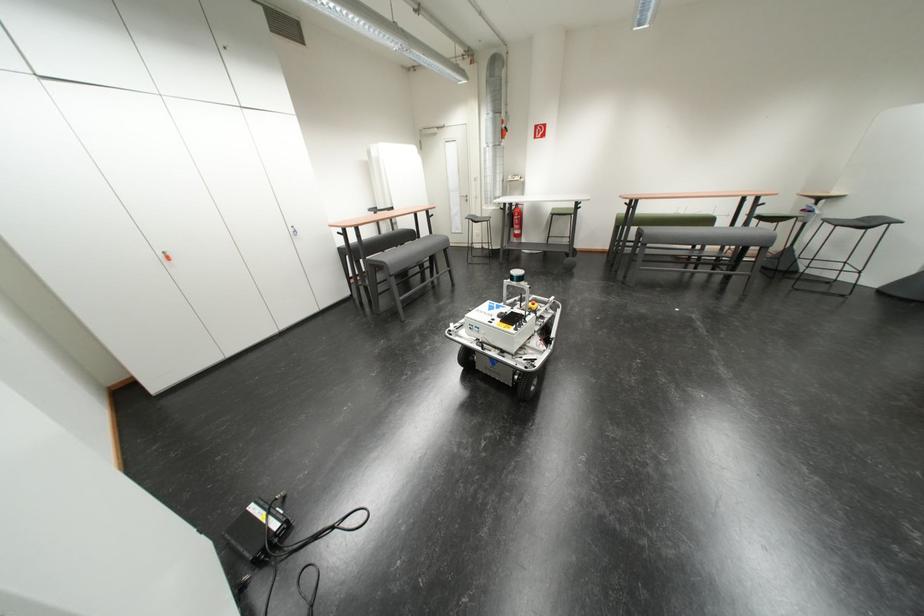
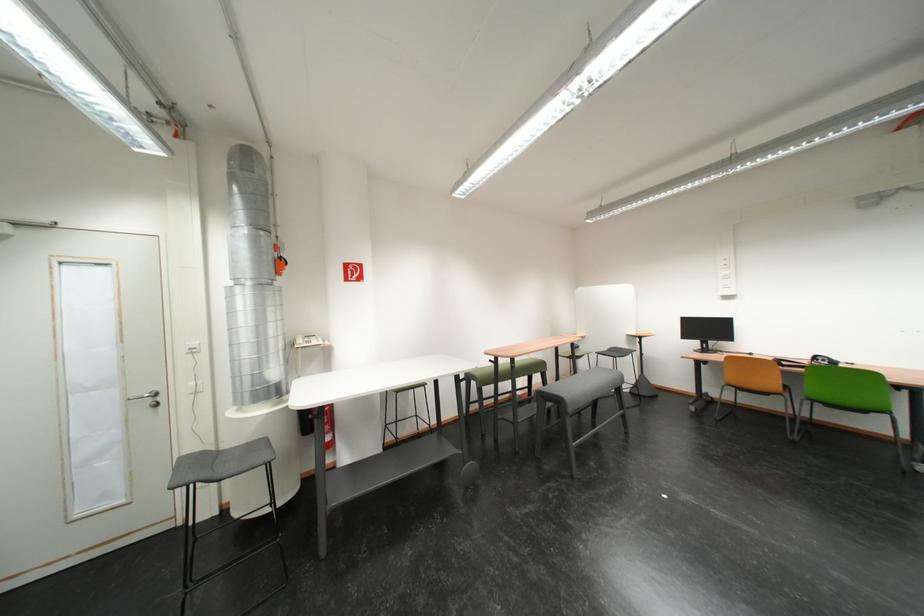
In the second image, find the point that corresponds to pixel 638 205 in the first image.

(505, 362)